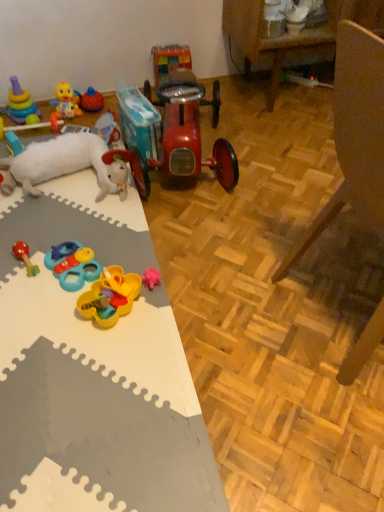
Where is `free location to the right of yellow plastic toy at center, positioned as the 9th toy in left-to-right order`? The image size is (384, 512). free location to the right of yellow plastic toy at center, positioned as the 9th toy in left-to-right order is located at coordinates (161, 310).